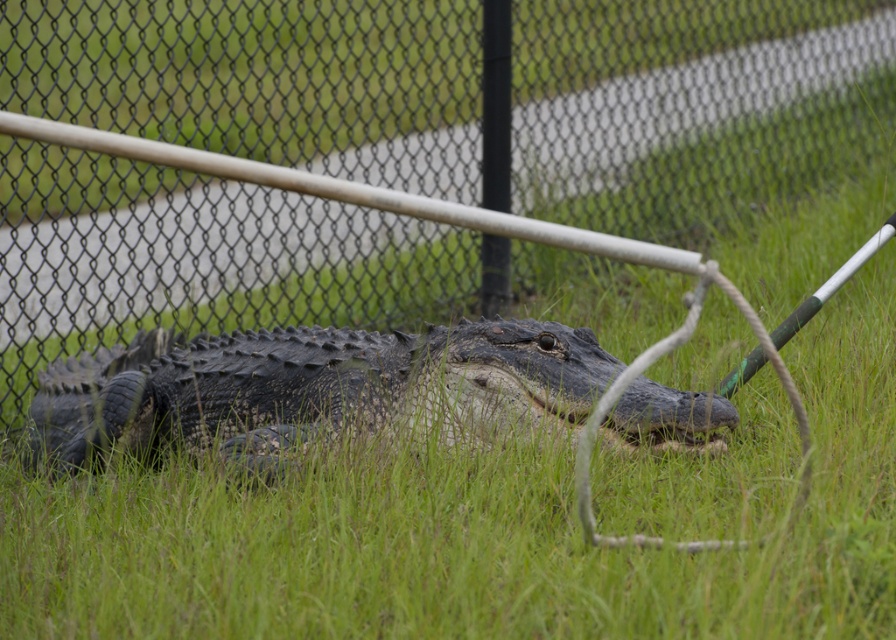
Based on the photo, does black chain-link fence at center have a lesser height compared to dark scaly crocodile at center?

Correct, black chain-link fence at center is not as tall as dark scaly crocodile at center.

Who is more forward, (x=692, y=102) or (x=259, y=376)?

Point (x=259, y=376) is more forward.

What are the coordinates of `black chain-link fence at center` in the screenshot? It's located at (688, 106).